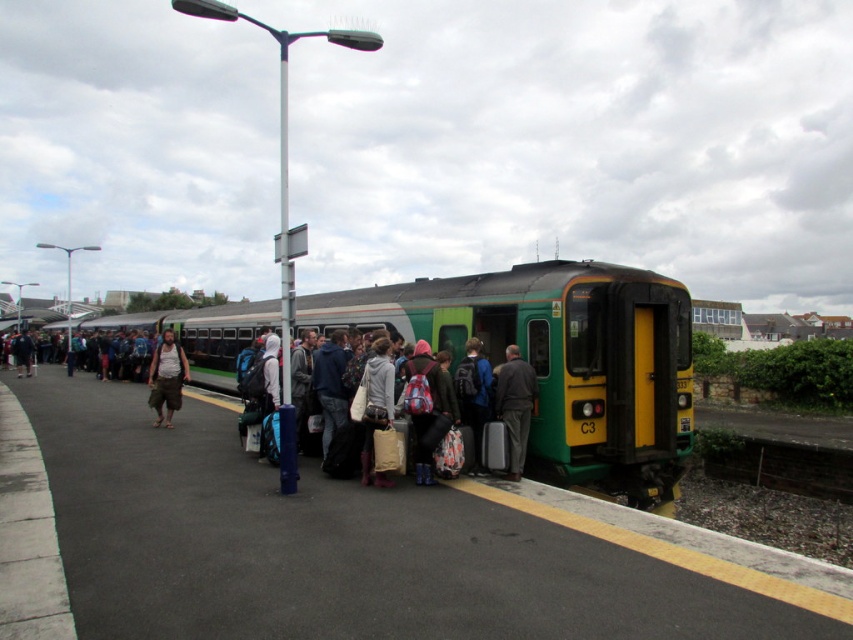
Can you confirm if green/yellow painted metal train at center is positioned to the left of brown cotton shorts at center?

Indeed, green/yellow painted metal train at center is positioned on the left side of brown cotton shorts at center.

Can you confirm if green/yellow painted metal train at center is positioned above brown cotton shorts at center?

Yes, green/yellow painted metal train at center is above brown cotton shorts at center.

Describe the element at coordinates (560, 358) in the screenshot. This screenshot has width=853, height=640. I see `green/yellow painted metal train at center` at that location.

At what (x,y) coordinates should I click in order to perform the action: click on green/yellow painted metal train at center. Please return your answer as a coordinate pair (x, y). Looking at the image, I should click on (560, 358).

Is green/yellow plastic train at center to the left of green/yellow painted metal train at center from the viewer's perspective?

No, green/yellow plastic train at center is not to the left of green/yellow painted metal train at center.

Does green/yellow plastic train at center lie in front of green/yellow painted metal train at center?

That is True.

Which is behind, point (415, 547) or point (450, 317)?

The point (450, 317) is more distant.

Where is `green/yellow plastic train at center`? Image resolution: width=853 pixels, height=640 pixels. green/yellow plastic train at center is located at coordinates (x=337, y=545).

Between point (729, 564) and point (149, 388), which one is positioned in front?

Point (729, 564) is in front.

You are a GUI agent. You are given a task and a screenshot of the screen. Output one action in this format:
    pyautogui.click(x=<x>, y=<y>)
    Task: Click on the green/yellow plastic train at center
    
    Given the screenshot: What is the action you would take?
    pyautogui.click(x=337, y=545)